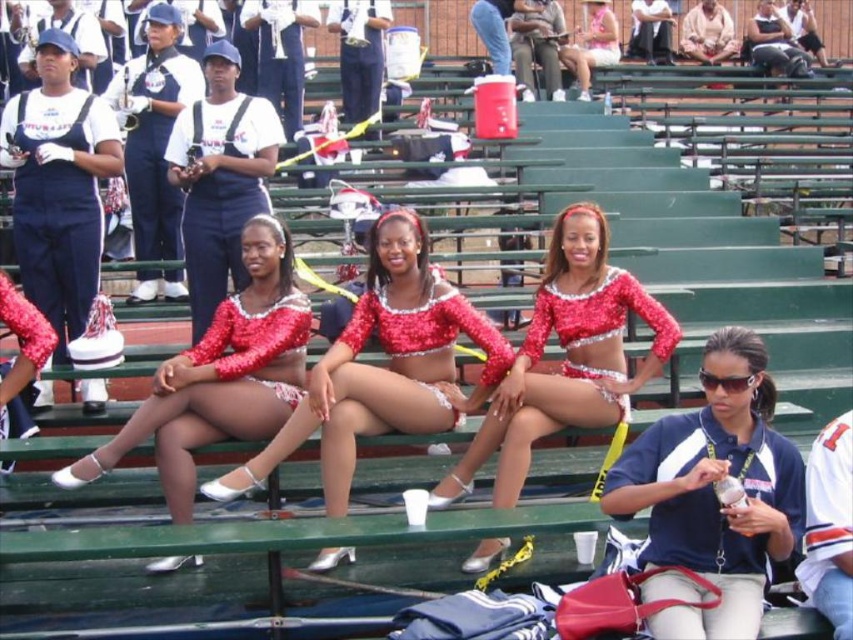
Based on the photo, you are a photographer at the event and want to capture a photo that includes both the shiny sequined top at center and the sparkly red sequin top at center. Which top should you focus on first if you want to ensure both are in the frame without moving the camera?

You should focus on the shiny sequined top at center first because it is shorter than the sparkly red sequin top at center, allowing you to frame both by adjusting the camera angle upwards.

You are a photographer positioned at the front of the stadium. You notice a pair of sunglasses at center in the image. Can you determine if the sunglasses are closer to the cheerleaders or the two individuals in navy blue uniforms?

The sunglasses at center is located at point (712, 492), which places it closer to the cheerleaders who are in the foreground compared to the two individuals in navy blue uniforms who are further back.